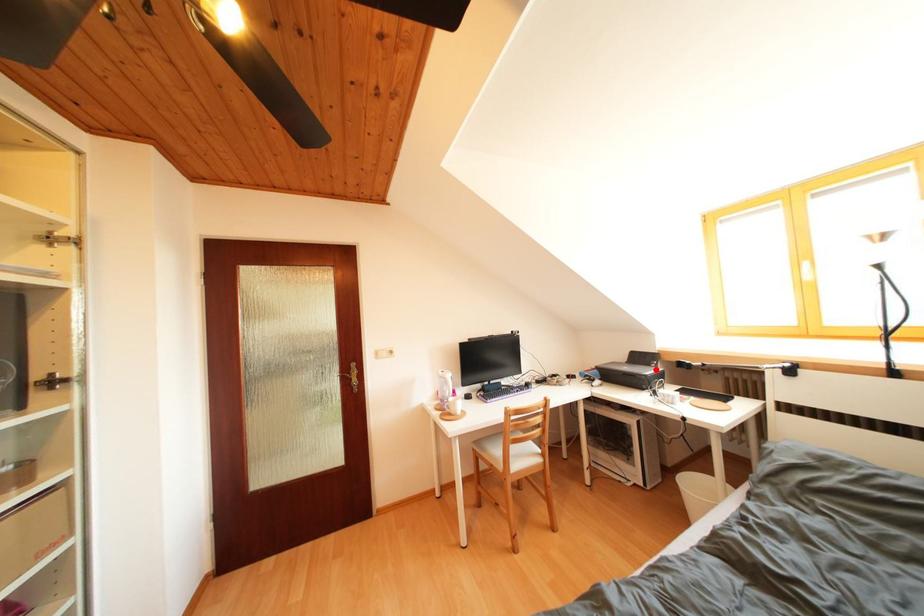
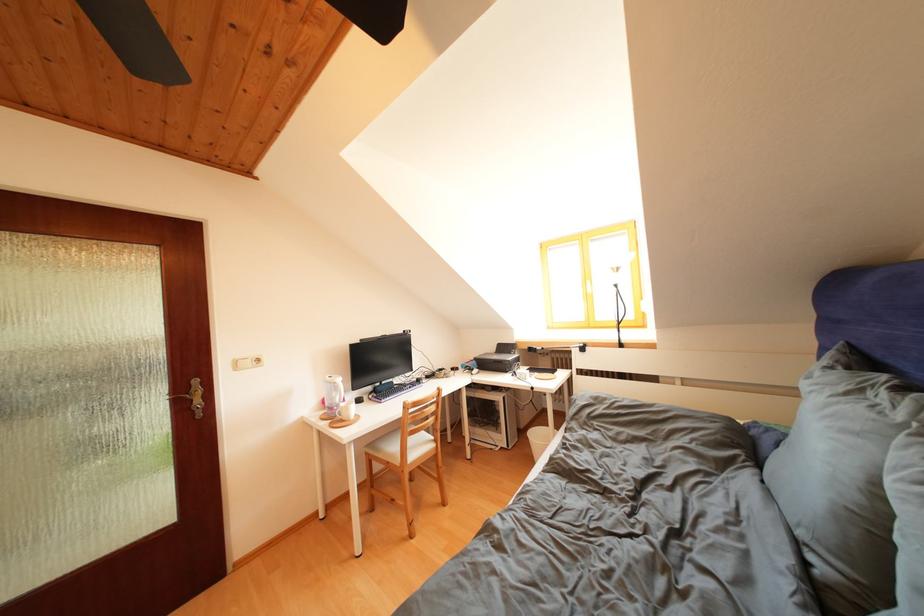
Locate, in the second image, the point that corresponds to the highlighted location in the first image.

(517, 358)